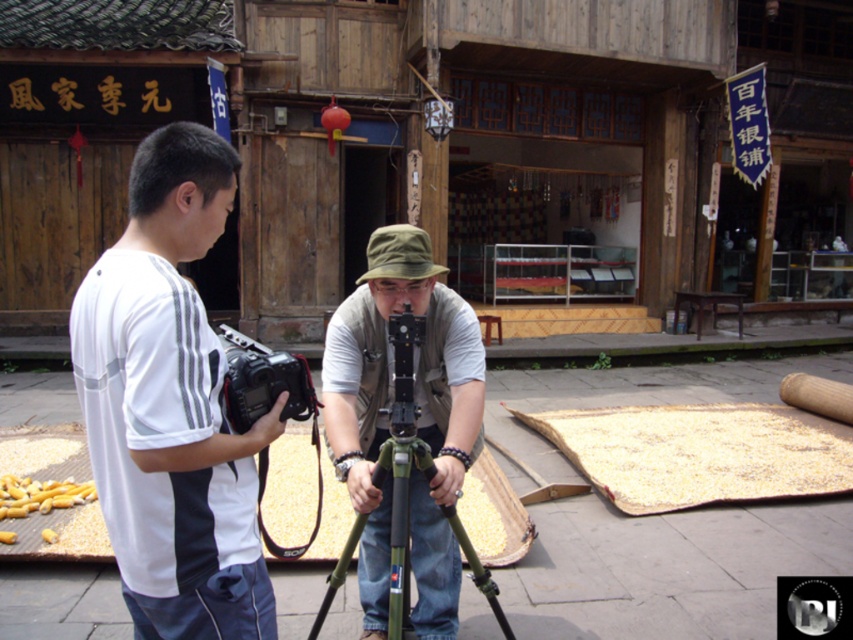
You are a photographer standing in front of the traditional Chinese village scene. You have a green matte tripod at center and a black plastic camera at center. Which object is closer to you, the photographer?

The green matte tripod at center is closer to you since it is positioned further to the viewer than the black plastic camera at center.